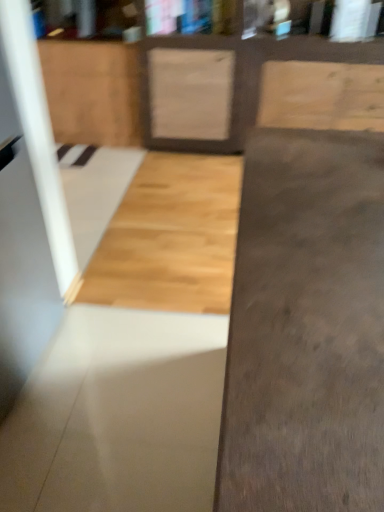
Question: Does gray concrete at center, the 1th concrete from the front, appear on the right side of natural wood cabinet at upper left?

Choices:
 (A) yes
 (B) no

Answer: (A)

Question: Considering the relative sizes of gray concrete at center, the 1th concrete from the front, and natural wood cabinet at upper left in the image provided, is gray concrete at center, the 1th concrete from the front, shorter than natural wood cabinet at upper left?

Choices:
 (A) no
 (B) yes

Answer: (A)

Question: Considering the relative sizes of gray concrete at center, acting as the second concrete starting from the back, and natural wood cabinet at upper left in the image provided, is gray concrete at center, acting as the second concrete starting from the back, smaller than natural wood cabinet at upper left?

Choices:
 (A) yes
 (B) no

Answer: (B)

Question: From the image's perspective, is gray concrete at center, the 1th concrete from the front, located above natural wood cabinet at upper left?

Choices:
 (A) yes
 (B) no

Answer: (B)

Question: Are gray concrete at center, the 1th concrete from the front, and natural wood cabinet at upper left located far from each other?

Choices:
 (A) yes
 (B) no

Answer: (A)

Question: Is smooth concrete at center, the second concrete in the front-to-back sequence, in front of or behind gray concrete at center, the 1th concrete from the front, in the image?

Choices:
 (A) behind
 (B) front

Answer: (A)

Question: Is smooth concrete at center, the second concrete in the front-to-back sequence, situated inside gray concrete at center, the 1th concrete from the front, or outside?

Choices:
 (A) inside
 (B) outside

Answer: (B)

Question: Looking at the image, does smooth concrete at center, the second concrete in the front-to-back sequence, seem bigger or smaller compared to gray concrete at center, the 1th concrete from the front?

Choices:
 (A) big
 (B) small

Answer: (B)

Question: Looking at their shapes, would you say smooth concrete at center, the second concrete in the front-to-back sequence, is wider or thinner than gray concrete at center, acting as the second concrete starting from the back?

Choices:
 (A) thin
 (B) wide

Answer: (B)

Question: Looking at the image, does natural wood cabinet at upper left seem bigger or smaller compared to gray concrete at center, acting as the second concrete starting from the back?

Choices:
 (A) small
 (B) big

Answer: (A)

Question: Is point (135, 105) closer or farther from the camera than point (302, 237)?

Choices:
 (A) farther
 (B) closer

Answer: (A)

Question: From the image's perspective, is natural wood cabinet at upper left above or below gray concrete at center, the 1th concrete from the front?

Choices:
 (A) above
 (B) below

Answer: (A)

Question: Choose the correct answer: Is natural wood cabinet at upper left inside gray concrete at center, acting as the second concrete starting from the back, or outside it?

Choices:
 (A) inside
 (B) outside

Answer: (B)

Question: In terms of height, does natural wood cabinet at upper left look taller or shorter compared to smooth concrete at center, the second concrete in the front-to-back sequence?

Choices:
 (A) short
 (B) tall

Answer: (B)

Question: Considering the positions of natural wood cabinet at upper left and smooth concrete at center, the second concrete in the front-to-back sequence, in the image, is natural wood cabinet at upper left wider or thinner than smooth concrete at center, the second concrete in the front-to-back sequence,?

Choices:
 (A) wide
 (B) thin

Answer: (B)